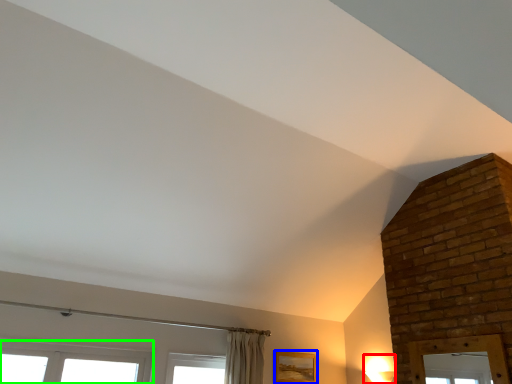
Question: Considering the real-world distances, which object is farthest from light fixture (highlighted by a red box)? picture frame (highlighted by a blue box) or window (highlighted by a green box)?

Choices:
 (A) picture frame
 (B) window

Answer: (B)